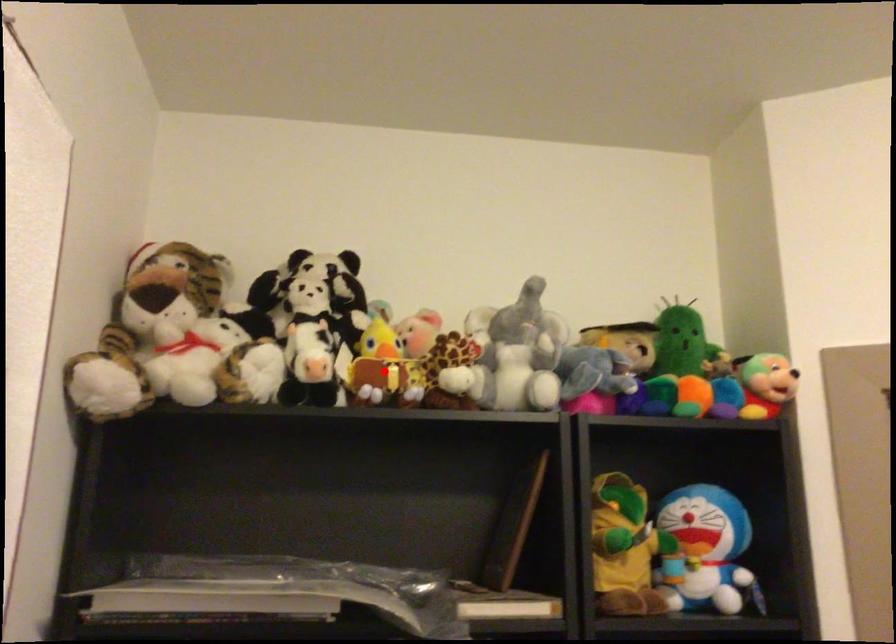
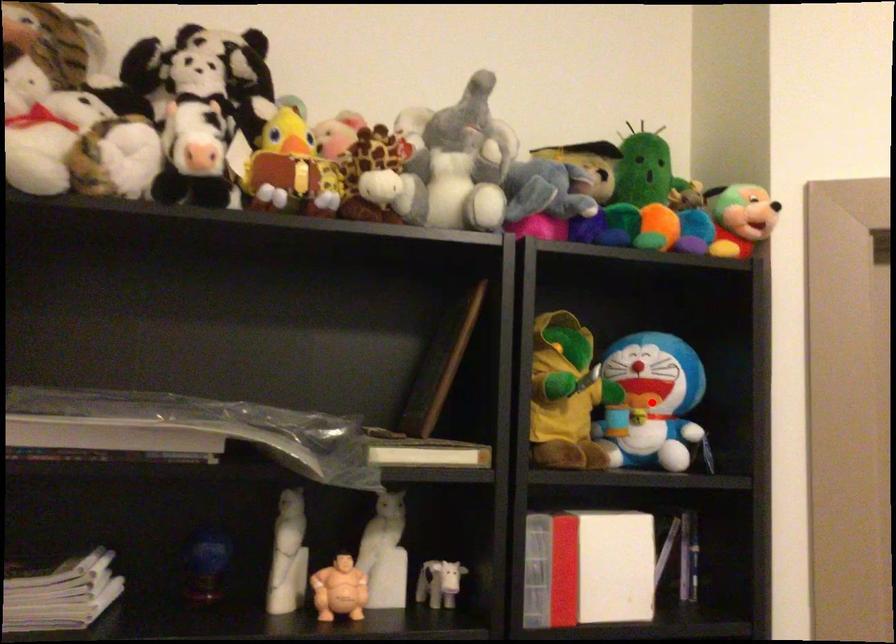
I am providing you with two images of the same scene from different viewpoints. A red point is marked on the first image and another point is marked on the second image. Does the point marked in image1 correspond to the same location as the one in image2?

No